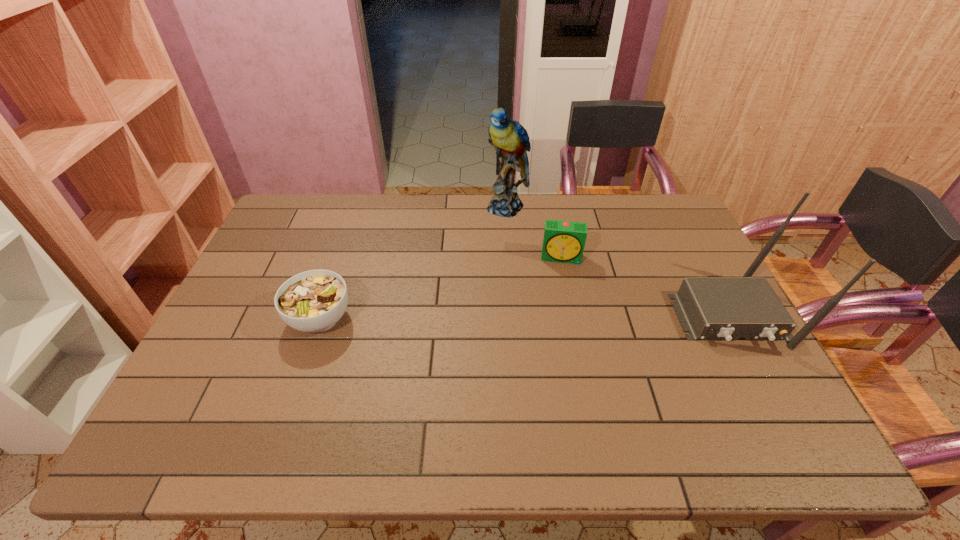
I want to click on the leftmost object, so click(313, 301).

You are a GUI agent. You are given a task and a screenshot of the screen. Output one action in this format:
    pyautogui.click(x=<x>, y=<y>)
    Task: Click on the soup bowl
    The width and height of the screenshot is (960, 540).
    Given the screenshot: What is the action you would take?
    pyautogui.click(x=313, y=301)

What are the coordinates of `the rightmost object` in the screenshot? It's located at pos(710,308).

Where is `router`? This screenshot has height=540, width=960. router is located at coordinates (710, 308).

In order to click on the second object from right to left in this screenshot , I will do `click(564, 241)`.

Where is `alarm clock`? This screenshot has height=540, width=960. alarm clock is located at coordinates (564, 241).

Where is `the tallest object`? This screenshot has height=540, width=960. the tallest object is located at coordinates coord(510,139).

You are a GUI agent. You are given a task and a screenshot of the screen. Output one action in this format:
    pyautogui.click(x=<x>, y=<y>)
    Task: Click on the third object from right to left
    
    Given the screenshot: What is the action you would take?
    pyautogui.click(x=510, y=139)

Locate an element on the screen. vacant point located 0.320m on the back of the leftmost object is located at coordinates (351, 226).

Identify the location of free space located on the back of the router to connect cables. The height and width of the screenshot is (540, 960). (769, 392).